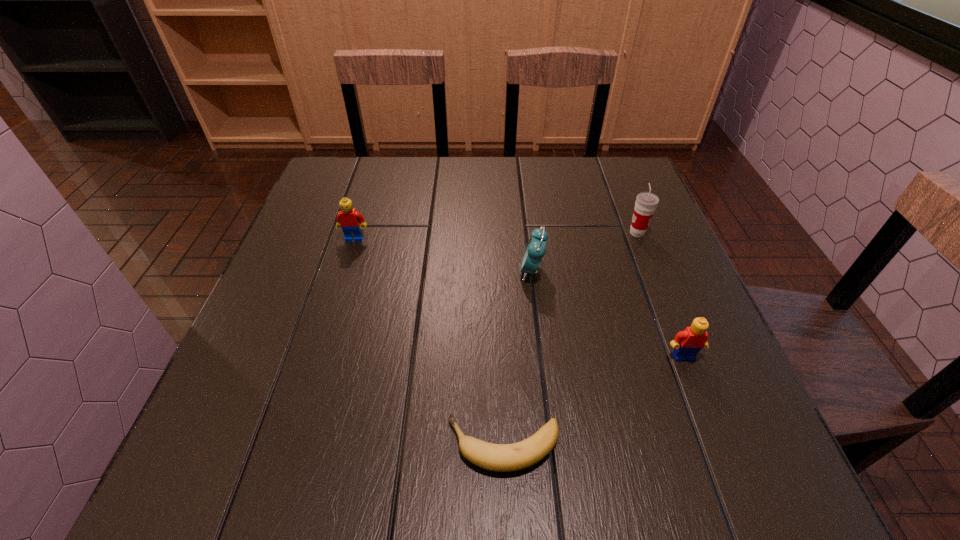
At what (x,y) coordinates should I click in order to perform the action: click on vacant space located 0.360m on the side of the tallest object with the logo. Please return your answer as a coordinate pair (x, y). Looking at the image, I should click on (478, 233).

Locate an element on the screen. Image resolution: width=960 pixels, height=540 pixels. free location located on the face of the third nearest object is located at coordinates (446, 271).

At what (x,y) coordinates should I click in order to perform the action: click on free space located 0.230m on the face of the third nearest object. Please return your answer as a coordinate pair (x, y). Image resolution: width=960 pixels, height=540 pixels. Looking at the image, I should click on (415, 271).

The image size is (960, 540). In order to click on free space located 0.070m on the face of the third nearest object in this screenshot , I will do `click(487, 271)`.

Identify the location of vacant space located on the face of the farther Lego. (319, 354).

Identify the location of free space located 0.220m on the face of the fourth farthest object. (734, 488).

This screenshot has height=540, width=960. Identify the location of vacant space positioned 0.110m at the stem of the banana. (377, 445).

Find the location of `free point located 0.180m at the stem of the banana`. free point located 0.180m at the stem of the banana is located at coordinates (333, 445).

Locate an element on the screen. The image size is (960, 540). vacant area situated 0.310m at the stem of the banana is located at coordinates (251, 445).

This screenshot has width=960, height=540. What are the coordinates of `object located in the near edge section of the desktop` in the screenshot? It's located at (495, 457).